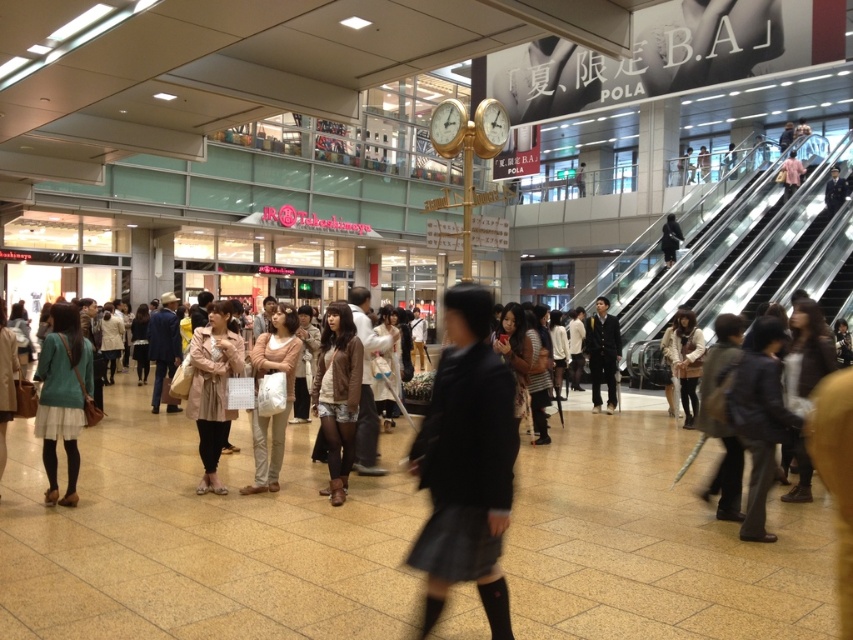
You are a store employee who needs to fold and store the light beige textured coat at center and the light beige pants at center. Based on their sizes, which item will require more storage space?

The light beige pants at center require more storage space since the light beige textured coat at center occupies less space than them according to the description.

You are an observer standing in the middle of the mall. You notice two people wearing dark gray skirt at center and light beige pants at center. Which one is closer to the ceiling?

The dark gray skirt at center is located above the light beige pants at center, so the dark gray skirt at center is closer to the ceiling.

You are a fashion designer observing the scene and want to compare the sizes of the dark gray skirt at center and the metallic silver escalator at upper right. Which object is larger?

The metallic silver escalator at upper right is larger than the dark gray skirt at center.